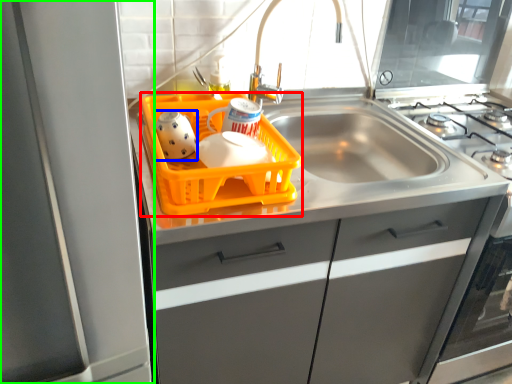
Question: Considering the real-world distances, which object is closest to basket (highlighted by a red box)? tea pot (highlighted by a blue box) or appliance (highlighted by a green box).

Choices:
 (A) tea pot
 (B) appliance

Answer: (A)